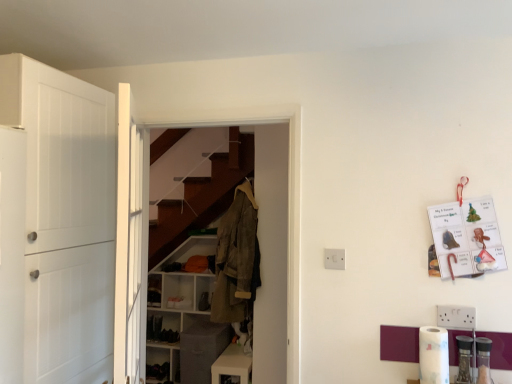
Question: Is white matte cabinet at center, the first cabinetry from the left, oriented towards white glossy cabinet at lower center, which is the first cabinetry in right-to-left order?

Choices:
 (A) yes
 (B) no

Answer: (B)

Question: Is white matte cabinet at center, which is the 2th cabinetry from front to back, further to the viewer compared to white glossy cabinet at lower center, marked as the first cabinetry in a front-to-back arrangement?

Choices:
 (A) yes
 (B) no

Answer: (A)

Question: From the image's perspective, is white matte cabinet at center, the 1th cabinetry positioned from the back, below white glossy cabinet at lower center, marked as the first cabinetry in a front-to-back arrangement?

Choices:
 (A) yes
 (B) no

Answer: (B)

Question: Can you confirm if white matte cabinet at center, which is the 2th cabinetry from front to back, is thinner than white glossy cabinet at lower center, positioned as the second cabinetry in back-to-front order?

Choices:
 (A) no
 (B) yes

Answer: (A)

Question: Can white glossy cabinet at lower center, positioned as the second cabinetry in back-to-front order, be found inside white matte cabinet at center, the 1th cabinetry positioned from the back?

Choices:
 (A) no
 (B) yes

Answer: (A)

Question: Can you confirm if white matte cabinet at center, the second cabinetry viewed from the right, is shorter than white glossy cabinet at lower center, marked as the first cabinetry in a front-to-back arrangement?

Choices:
 (A) no
 (B) yes

Answer: (A)

Question: Can you confirm if white glossy cabinet at lower center, which is the first cabinetry in right-to-left order, is bigger than white plastic electric outlet at center?

Choices:
 (A) no
 (B) yes

Answer: (B)

Question: From the image's perspective, is white glossy cabinet at lower center, positioned as the second cabinetry in back-to-front order, beneath white plastic electric outlet at center?

Choices:
 (A) yes
 (B) no

Answer: (A)

Question: Is white glossy cabinet at lower center, which is the first cabinetry in right-to-left order, further to the viewer compared to white plastic electric outlet at center?

Choices:
 (A) no
 (B) yes

Answer: (B)

Question: Is white glossy cabinet at lower center, positioned as the second cabinetry in back-to-front order, smaller than white plastic electric outlet at center?

Choices:
 (A) no
 (B) yes

Answer: (A)

Question: Is white glossy cabinet at lower center, the 2th cabinetry from the left, directly adjacent to white plastic electric outlet at center?

Choices:
 (A) yes
 (B) no

Answer: (B)

Question: From a real-world perspective, is white glossy cabinet at lower center, marked as the first cabinetry in a front-to-back arrangement, positioned over white plastic electric outlet at center based on gravity?

Choices:
 (A) no
 (B) yes

Answer: (A)

Question: Is there a large distance between white matte door at left, placed as the 1th door when sorted from left to right, and white glossy cabinet at lower center, positioned as the second cabinetry in back-to-front order?

Choices:
 (A) yes
 (B) no

Answer: (A)